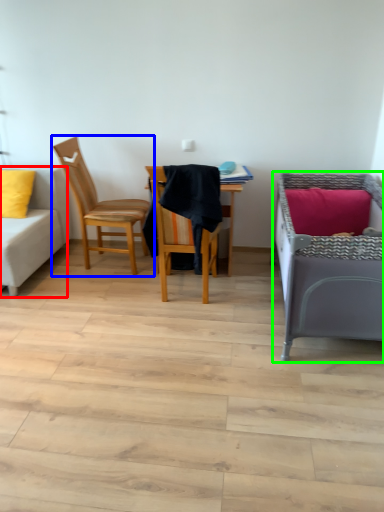
Question: Estimate the real-world distances between objects in this image. Which object is closer to studio couch (highlighted by a red box), chair (highlighted by a blue box) or infant bed (highlighted by a green box)?

Choices:
 (A) chair
 (B) infant bed

Answer: (A)